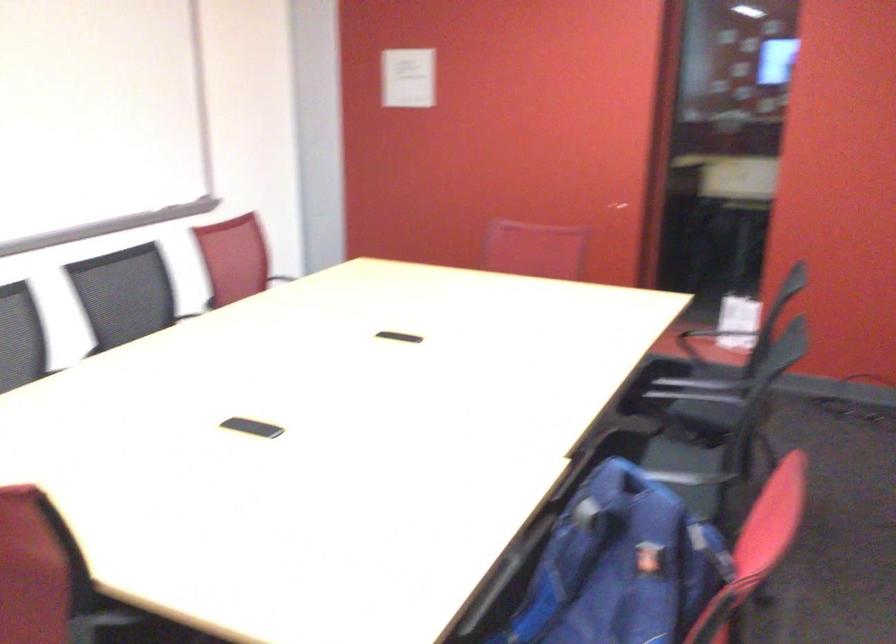
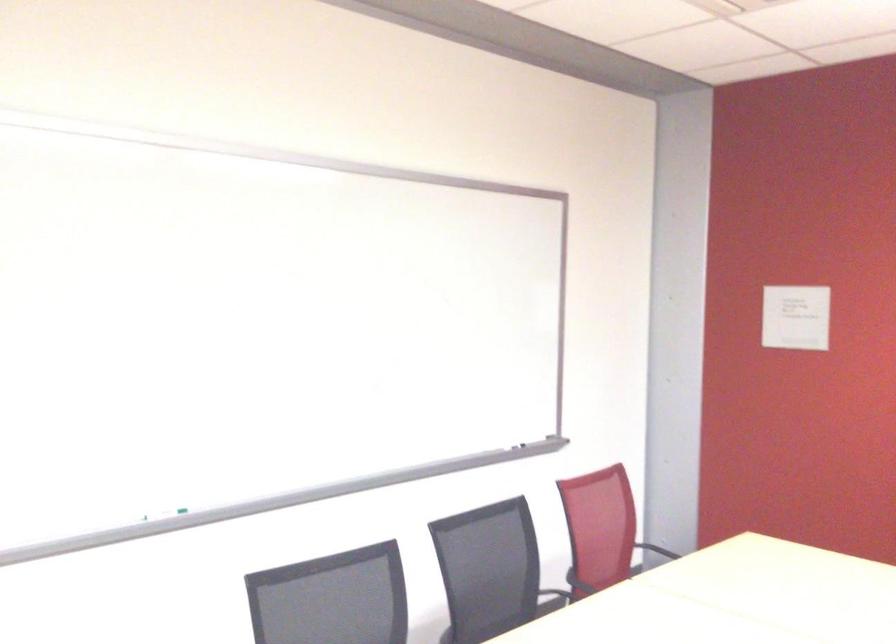
In a continuous first-person perspective shot, in which direction is the camera moving?

The cameraman walked toward left, forward.